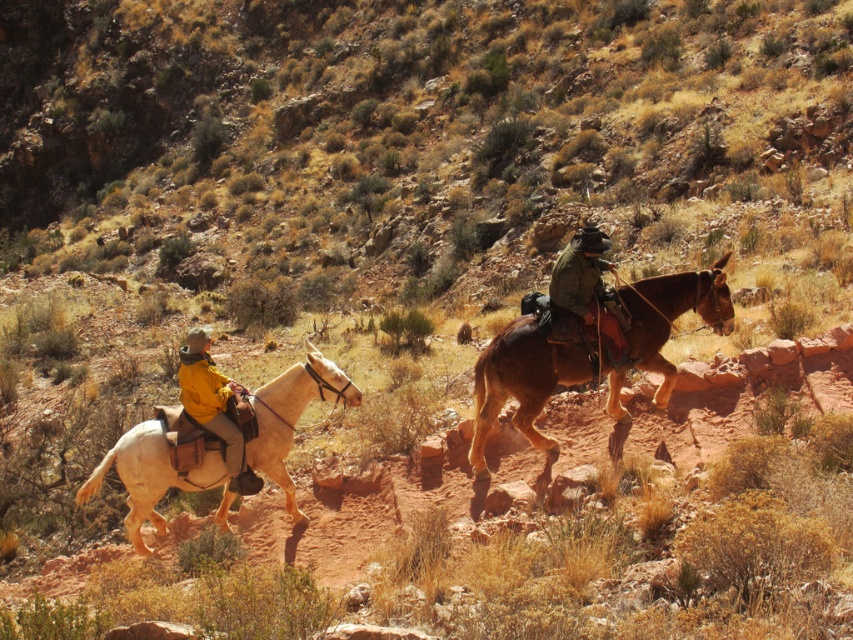
You are a photographer trying to capture the scene of two riders in the desert. You want to ensure that both the brown leather horse at center and the yellow matte jacket at left are visible in your shot. Based on their positions, which object should be placed closer to the left edge of the photo to maintain their natural arrangement?

The yellow matte jacket at left should be placed closer to the left edge of the photo because the brown leather horse at center is to the right of the yellow matte jacket at left, so positioning the jacket on the left maintains their natural arrangement.

You are a photographer trying to capture a clear photo of the white leather horse at left and the yellow matte jacket at left. Which object should you focus on first if you want to ensure both are in focus, considering their sizes in the frame?

The white leather horse at left has a lesser height compared to the yellow matte jacket at left, so you should focus on the yellow matte jacket at left first since it is taller and might be easier to capture clearly.